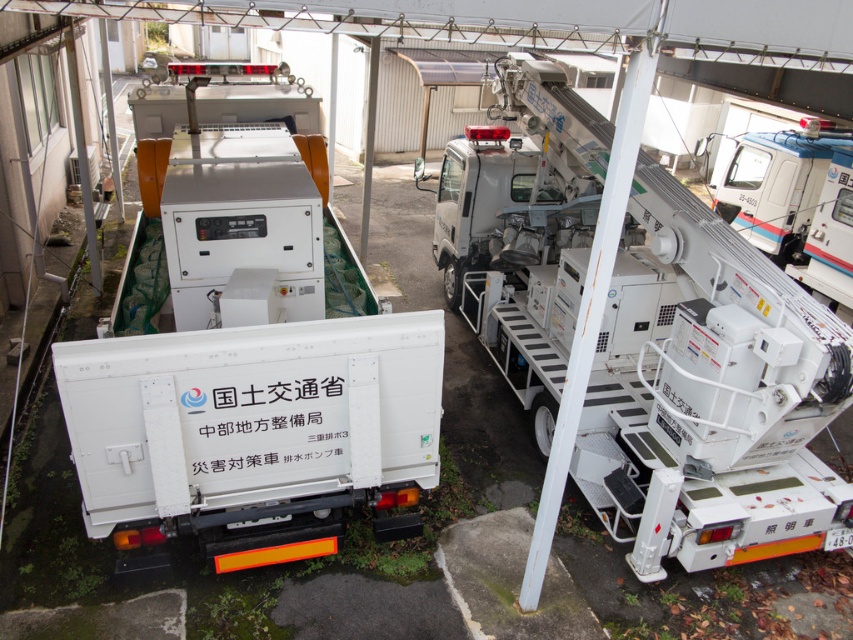
Please provide the coordinates of the white matte truck at center in the image. The coordinates should be in the format of a point with two decimal places, such as 0.569, 0.293.

The coordinates of the white matte truck at center are at point (248, 364).

You are a maintenance worker in the yard. You need to locate the white metallic truck at right. Where should you look relative to the point marked at coordinates (x=712, y=394)?

The white metallic truck at right is located at the point marked at coordinates (x=712, y=394).

You are a technician in the yard and need to access both the white metallic truck at right and the white plastic truck at upper right. Which truck is positioned lower in the image?

The white metallic truck at right is positioned lower than the white plastic truck at upper right.